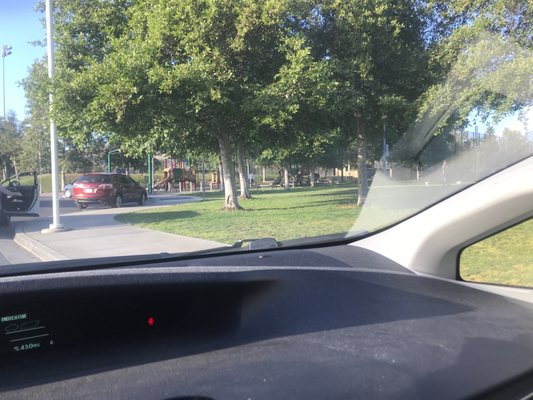
Locate an element on the screen. The image size is (533, 400). door is located at coordinates (39, 201), (129, 188).